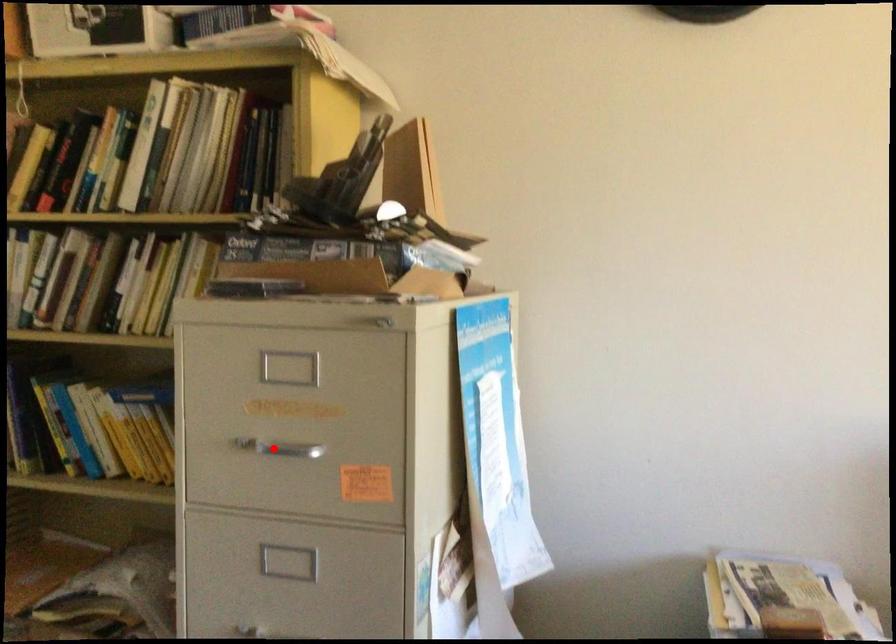
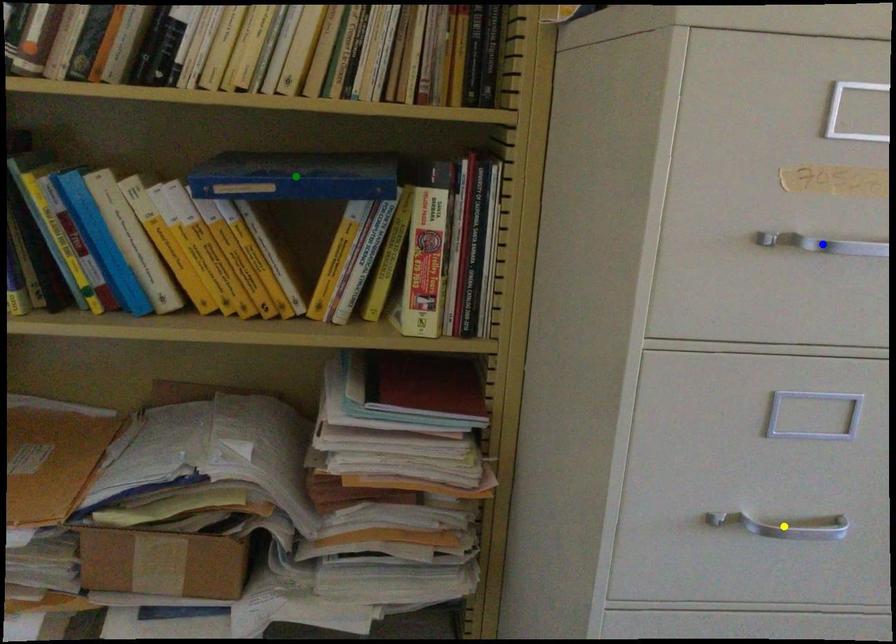
Question: I am providing you with two images of the same scene from different viewpoints. A red point is marked on the first image. You are given multiple points on the second image. In image 2, which mark is for the same physical point as the one in image 1?

Choices:
 (A) blue point
 (B) yellow point
 (C) green point

Answer: (A)